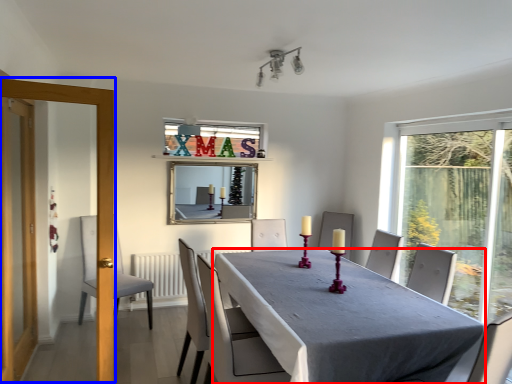
Question: Which point is further to the camera, table (highlighted by a red box) or screen door (highlighted by a blue box)?

Choices:
 (A) table
 (B) screen door

Answer: (B)